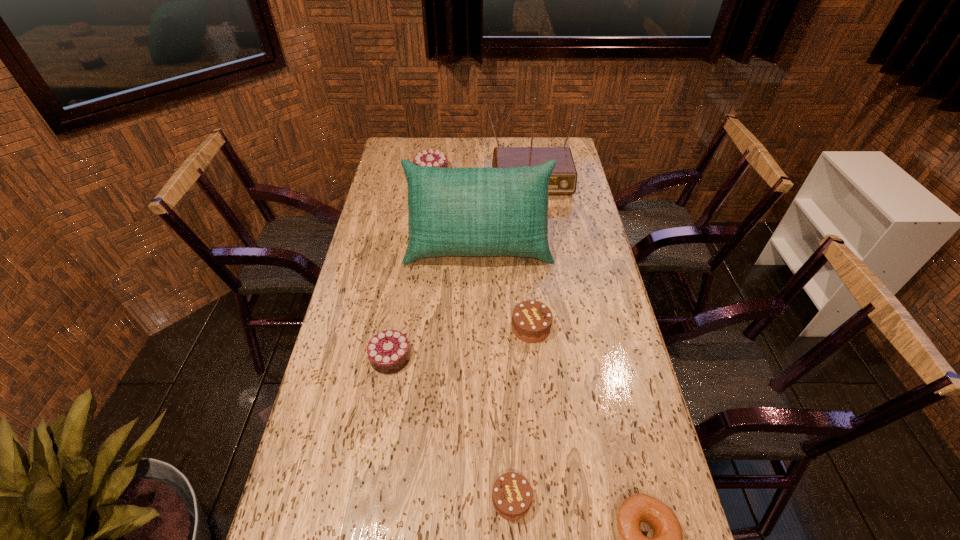
Identify the location of free region located on the left of the farthest chocolate cake. (394, 172).

In order to click on vacant area situated on the left of the bigger brown chocolate cake in this screenshot , I will do `click(430, 327)`.

Identify the location of vacant space located on the front of the smaller chocolate chocolate cake. (383, 401).

The width and height of the screenshot is (960, 540). I want to click on free region located 0.230m on the left of the nearer brown chocolate cake, so click(x=392, y=500).

Find the location of a particular element. The width and height of the screenshot is (960, 540). radio_receiver present at the far edge is located at coordinates (563, 180).

Locate an element on the screen. The width and height of the screenshot is (960, 540). chocolate cake that is at the far edge is located at coordinates (431, 158).

You are a GUI agent. You are given a task and a screenshot of the screen. Output one action in this format:
    pyautogui.click(x=<x>, y=<y>)
    Task: Click on the object located at the right edge
    This screenshot has height=540, width=960.
    Given the screenshot: What is the action you would take?
    pyautogui.click(x=563, y=180)

You are a GUI agent. You are given a task and a screenshot of the screen. Output one action in this format:
    pyautogui.click(x=<x>, y=<y>)
    Task: Click on the object that is at the far left corner
    This screenshot has width=960, height=540.
    Given the screenshot: What is the action you would take?
    pyautogui.click(x=431, y=158)

Where is `object that is at the far right corner`? This screenshot has width=960, height=540. object that is at the far right corner is located at coordinates (563, 180).

This screenshot has width=960, height=540. In order to click on vacant area at the left edge of the desktop in this screenshot , I will do click(387, 239).